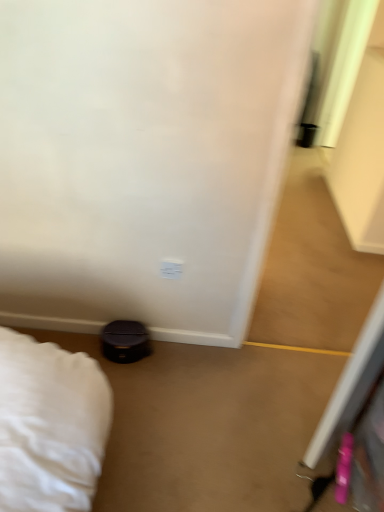
Image resolution: width=384 pixels, height=512 pixels. Describe the element at coordinates (171, 268) in the screenshot. I see `white matte electric outlet at center` at that location.

Where is `white matte electric outlet at center`? The width and height of the screenshot is (384, 512). white matte electric outlet at center is located at coordinates (171, 268).

Measure the distance between white matte electric outlet at center and camera.

white matte electric outlet at center and camera are 5.37 feet apart.

Measure the distance between point (175,260) and camera.

The distance of point (175,260) from camera is 5.37 feet.

This screenshot has height=512, width=384. I want to click on white matte electric outlet at center, so click(171, 268).